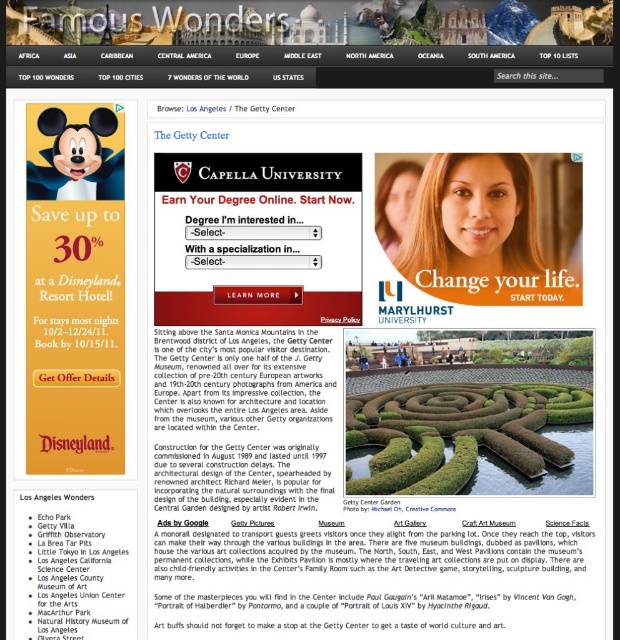
Question: Which point is farther to the camera?

Choices:
 (A) (383, 228)
 (B) (456, 282)
 (C) (559, 346)

Answer: (C)

Question: From the image, what is the correct spatial relationship of green leafy hedge at center in relation to blonde hair at upper center?

Choices:
 (A) above
 (B) below

Answer: (B)

Question: Among these points, which one is farthest from the camera?

Choices:
 (A) (463, 189)
 (B) (585, 356)

Answer: (B)

Question: Which object is positioned closest to the green leafy hedge at center?

Choices:
 (A) blonde hair at upper center
 (B) smooth skin face at center

Answer: (B)

Question: Is smooth skin face at center bigger than green leafy hedge at center?

Choices:
 (A) no
 (B) yes

Answer: (A)

Question: Is green leafy hedge at center to the right of blonde hair at upper center from the viewer's perspective?

Choices:
 (A) no
 (B) yes

Answer: (B)